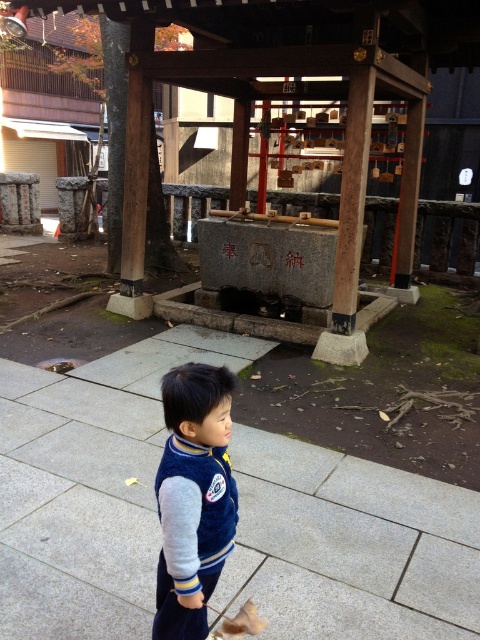
You are a photographer trying to capture the child in the velvet blue jacket at center without the gray concrete pavement at center blocking the view. Is it possible to adjust your position so that the child is visible while avoiding the pavement?

The velvet blue jacket at center is behind the gray concrete pavement at center, so you cannot see the child through the pavement. Move to a position where you can see behind the pavement to capture the child.